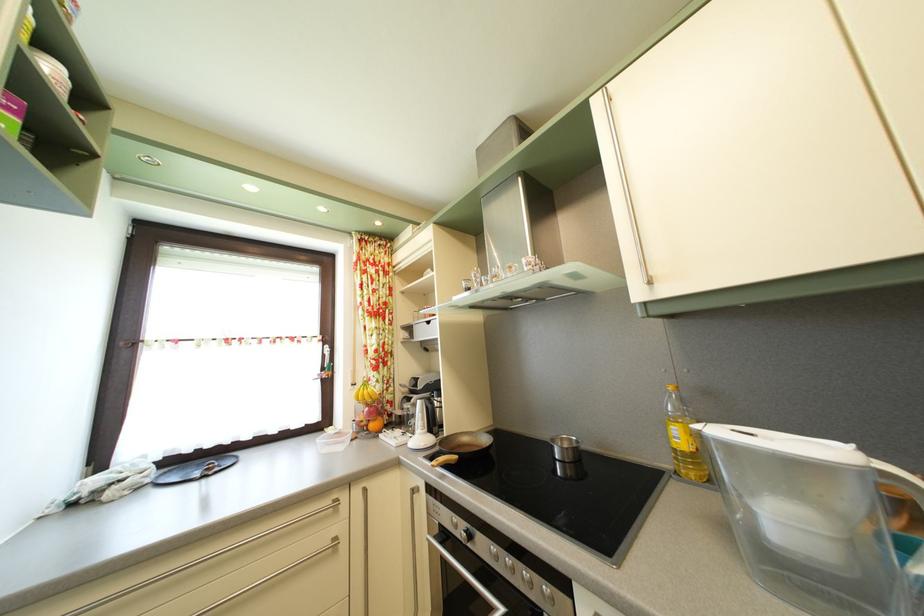
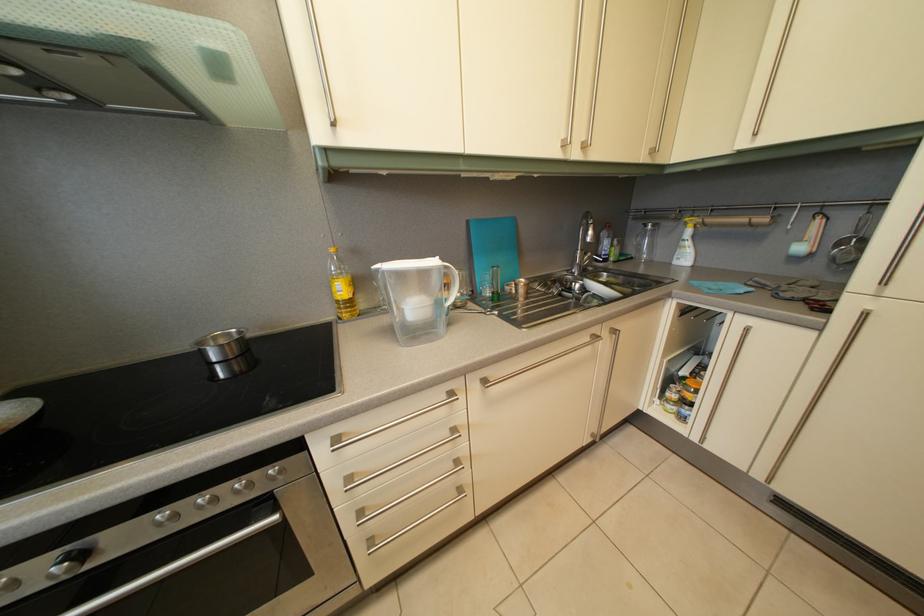
In the second image, find the point that corresponds to (478,545) in the first image.

(92, 562)